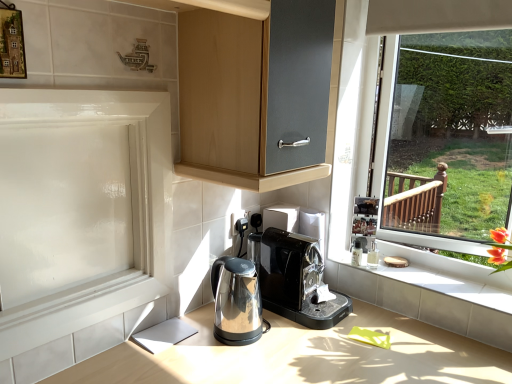
The width and height of the screenshot is (512, 384). What are the coordinates of `empty space that is ontop of satin metallic countertop at center (from a real-world perspective)` in the screenshot? It's located at (332, 347).